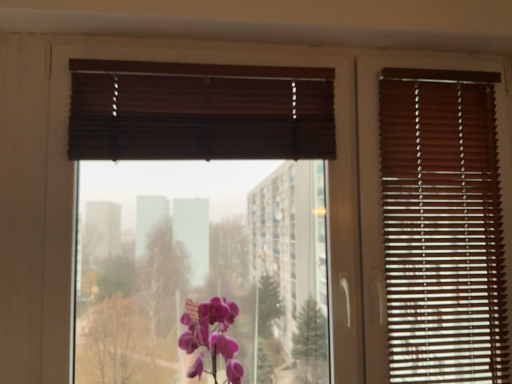
Describe the element at coordinates (211, 337) in the screenshot. This screenshot has height=384, width=512. I see `purple glossy orchid at center` at that location.

At what (x,y) coordinates should I click in order to perform the action: click on purple glossy orchid at center. Please return your answer as a coordinate pair (x, y). Image resolution: width=512 pixels, height=384 pixels. Looking at the image, I should click on (211, 337).

Describe the element at coordinates (200, 111) in the screenshot. This screenshot has width=512, height=384. I see `brown wood blinds at center` at that location.

In order to click on brown wood blinds at center in this screenshot , I will do `click(200, 111)`.

Locate an element on the screen. purple glossy orchid at center is located at coordinates (211, 337).

Considering the positions of objects purple glossy orchid at center and brown wood blinds at center in the image provided, who is more to the right, purple glossy orchid at center or brown wood blinds at center?

purple glossy orchid at center.

Which object is more forward, purple glossy orchid at center or brown wood blinds at center?

Positioned in front is purple glossy orchid at center.

Is point (184, 348) closer or farther from the camera than point (332, 95)?

Point (184, 348).

From the image's perspective, is purple glossy orchid at center over brown wood blinds at center?

No, from the image's perspective, purple glossy orchid at center is not above brown wood blinds at center.

From a real-world perspective, relative to brown wood blinds at center, is purple glossy orchid at center vertically above or below?

In terms of real-world spatial position, purple glossy orchid at center is below brown wood blinds at center.

Based on the photo, is purple glossy orchid at center wider than brown wood blinds at center?

Yes, purple glossy orchid at center is wider than brown wood blinds at center.

Considering the sizes of objects purple glossy orchid at center and brown wood blinds at center in the image provided, who is shorter, purple glossy orchid at center or brown wood blinds at center?

purple glossy orchid at center.

Consider the image. Between purple glossy orchid at center and brown wood blinds at center, which one has larger size?

brown wood blinds at center.

Is purple glossy orchid at center spatially inside brown wood blinds at center, or outside of it?

purple glossy orchid at center is spatially situated outside brown wood blinds at center.

Does purple glossy orchid at center touch brown wood blinds at center?

No, purple glossy orchid at center is not touching brown wood blinds at center.

Is brown wood blinds at center at the back of purple glossy orchid at center?

Correct, purple glossy orchid at center is looking away from brown wood blinds at center.

Find the location of `flower below the brown wood blinds at center (from the image's perspective)`. flower below the brown wood blinds at center (from the image's perspective) is located at coordinates (211, 337).

Is brown wood blinds at center to the left of purple glossy orchid at center from the viewer's perspective?

Indeed, brown wood blinds at center is positioned on the left side of purple glossy orchid at center.

Considering the relative positions of brown wood blinds at center and purple glossy orchid at center in the image provided, is brown wood blinds at center behind purple glossy orchid at center?

Yes, brown wood blinds at center is behind purple glossy orchid at center.

Is point (90, 61) closer or farther from the camera than point (190, 352)?

Point (90, 61) appears to be farther away from the viewer than point (190, 352).

From the image's perspective, is brown wood blinds at center over purple glossy orchid at center?

Yes, from the image's perspective, brown wood blinds at center is on top of purple glossy orchid at center.

From a real-world perspective, does brown wood blinds at center sit lower than purple glossy orchid at center?

No, from a real-world perspective, brown wood blinds at center is not under purple glossy orchid at center.

Does brown wood blinds at center have a lesser width compared to purple glossy orchid at center?

Yes.

Who is shorter, brown wood blinds at center or purple glossy orchid at center?

With less height is purple glossy orchid at center.

Considering the sizes of objects brown wood blinds at center and purple glossy orchid at center in the image provided, who is bigger, brown wood blinds at center or purple glossy orchid at center?

brown wood blinds at center.

Based on the photo, is purple glossy orchid at center inside brown wood blinds at center?

No, purple glossy orchid at center is located outside of brown wood blinds at center.

Is brown wood blinds at center next to purple glossy orchid at center and touching it?

brown wood blinds at center and purple glossy orchid at center are not in contact.

Is brown wood blinds at center aimed at purple glossy orchid at center?

Yes, brown wood blinds at center is oriented towards purple glossy orchid at center.

How different are the orientations of brown wood blinds at center and purple glossy orchid at center in degrees?

There is a 0.182-degree angle between the facing directions of brown wood blinds at center and purple glossy orchid at center.

You are a GUI agent. You are given a task and a screenshot of the screen. Output one action in this format:
    pyautogui.click(x=<x>, y=<y>)
    Task: Click on the flower in front of the brown wood blinds at center
    
    Given the screenshot: What is the action you would take?
    pyautogui.click(x=211, y=337)

The image size is (512, 384). In order to click on window screen that is above the purple glossy orchid at center (from the image's perspective) in this screenshot , I will do `click(200, 111)`.

Find the location of a particular element. This screenshot has height=384, width=512. flower that is in front of the brown wood blinds at center is located at coordinates (211, 337).